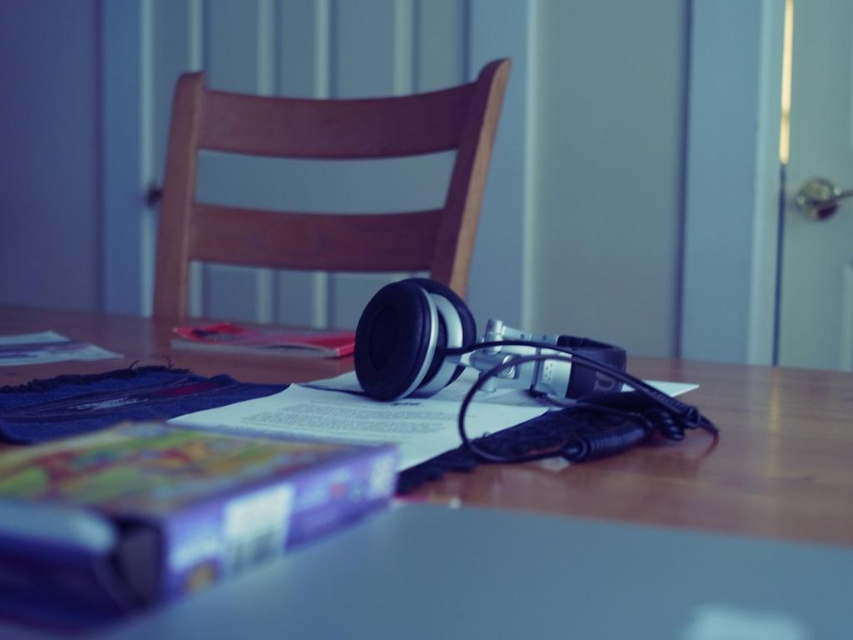
You are sitting in the wooden chair at center and want to reach the wooden table at center. Which direction should you move to get closer to the table?

The wooden table at center is located below the wooden chair at center, so you should move downward to get closer to the table.

You are standing in front of the wooden table with items scattered on it. There is a point at coordinates point [303,221] that you want to reach. Can you estimate how far this point is from your current position?

The point [303,221] is 1.58 meters away from the camera, so it is approximately 1.58 meters away from your current position.

You are standing in front of the wooden table and want to reach a point that is 20 centimeters away from you. Is the point at coordinates point (575,616) within your reach?

The point (575,616) is 19.68 centimeters away from the viewer, so yes, it is within reach as it is slightly closer than 20 centimeters.